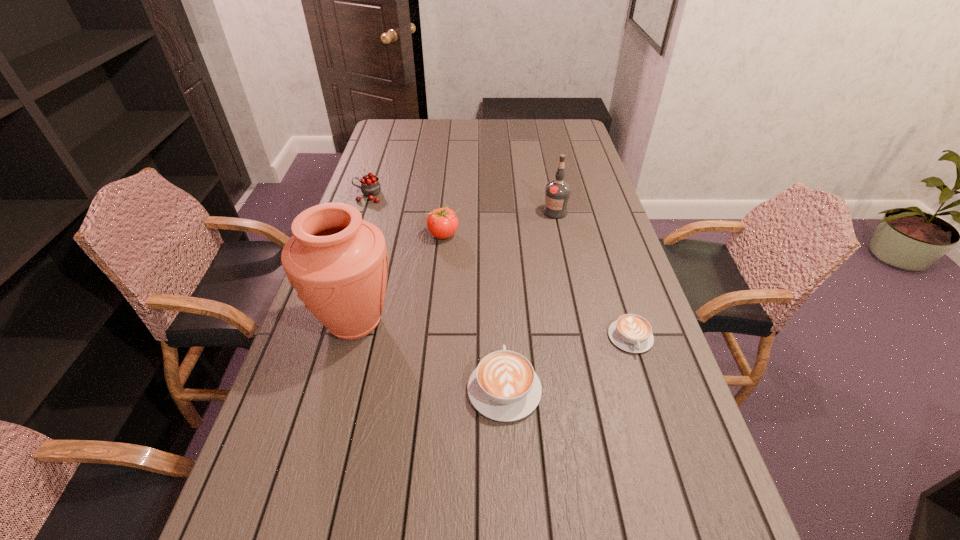
You are a GUI agent. You are given a task and a screenshot of the screen. Output one action in this format:
    pyautogui.click(x=<x>, y=<y>)
    Task: Click on the free point that keeps the cappuccinos evenly spaced on the left
    The image size is (960, 540).
    Given the screenshot: What is the action you would take?
    pyautogui.click(x=348, y=451)